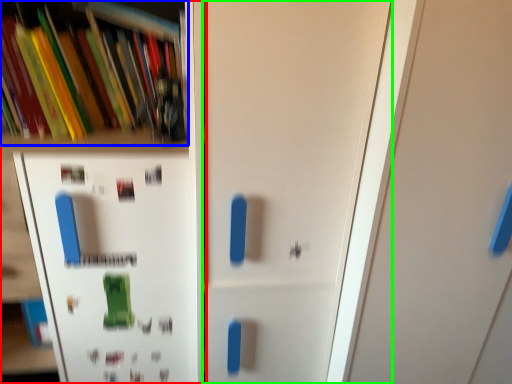
Question: Considering the real-world distances, which object is closest to shelf (highlighted by a red box)? book (highlighted by a blue box) or door (highlighted by a green box).

Choices:
 (A) book
 (B) door

Answer: (A)